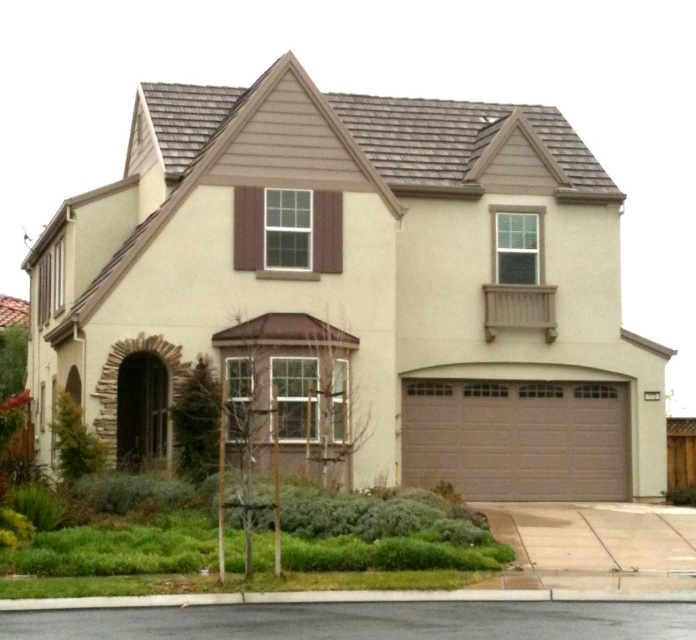
You are a delivery person trying to park your van in front of the house. The van requires a space that is at least as wide as the matte brown garage door at center. Can you determine if the brown textured garage door at center is wide enough to accommodate the van?

The matte brown garage door at center might be wider than brown textured garage door at center, so it is uncertain if the brown textured garage door at center is wide enough to accommodate the van.

You are standing in front of the house and want to locate the point at coordinates point (358, 289). According to the scene description, where exactly is this point located?

The point (358, 289) is located on the matte brown garage door at center.